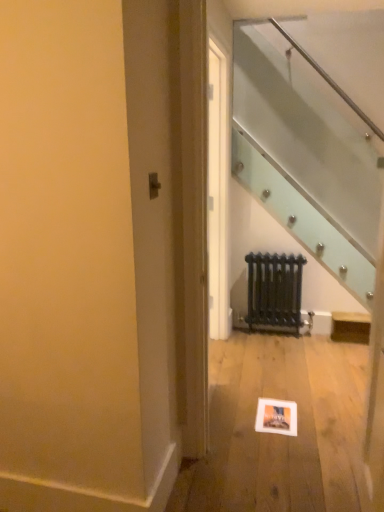
Identify the location of vacant area situated to the left side of matte orange picture frame at lower center. This screenshot has height=512, width=384. (234, 411).